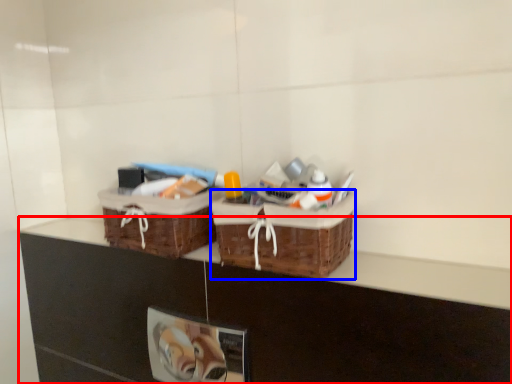
Question: Among these objects, which one is farthest to the camera, counter (highlighted by a red box) or picnic basket (highlighted by a blue box)?

Choices:
 (A) counter
 (B) picnic basket

Answer: (B)